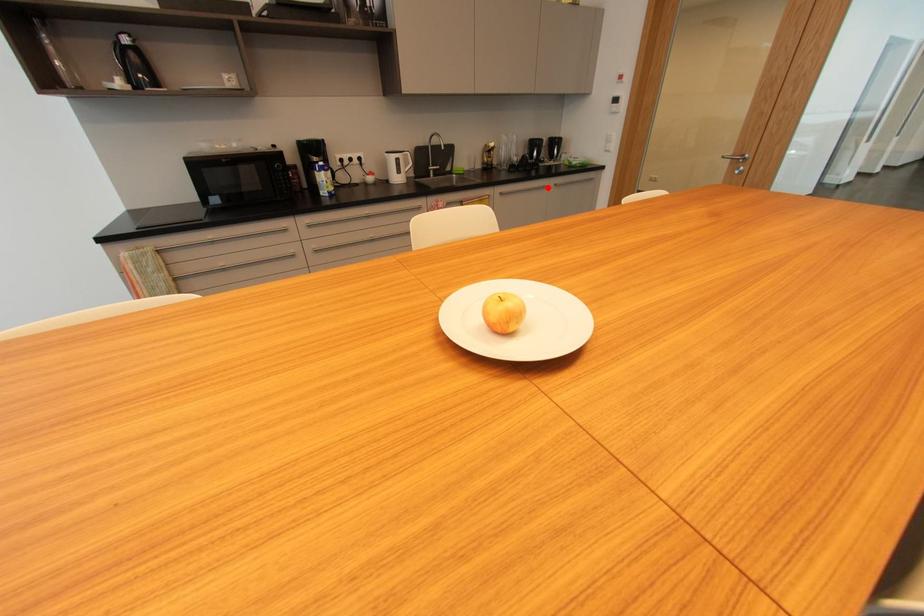
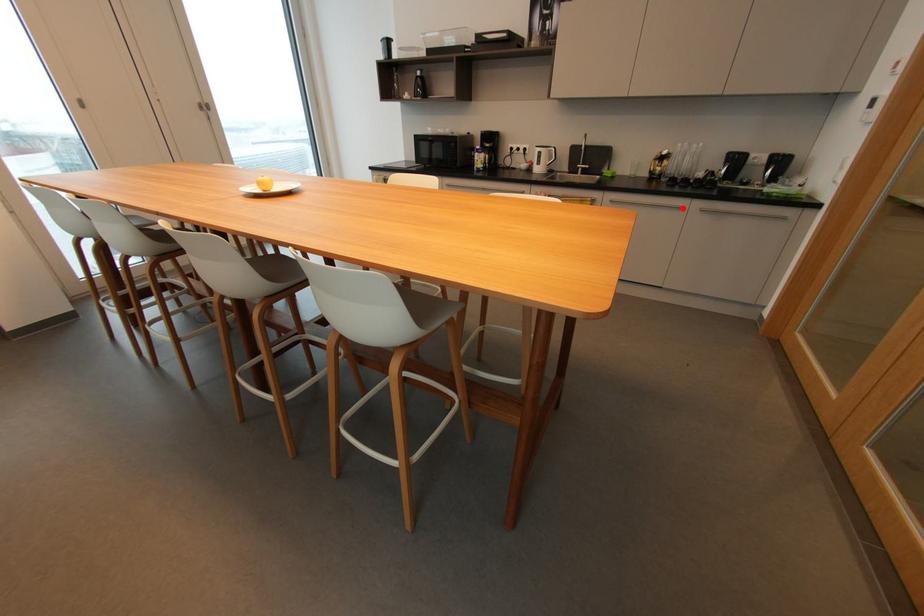
I am providing you with two images of the same scene from different viewpoints. A red point is marked on the first image and another point is marked on the second image. Does the point marked in image1 correspond to the same location as the one in image2?

Yes